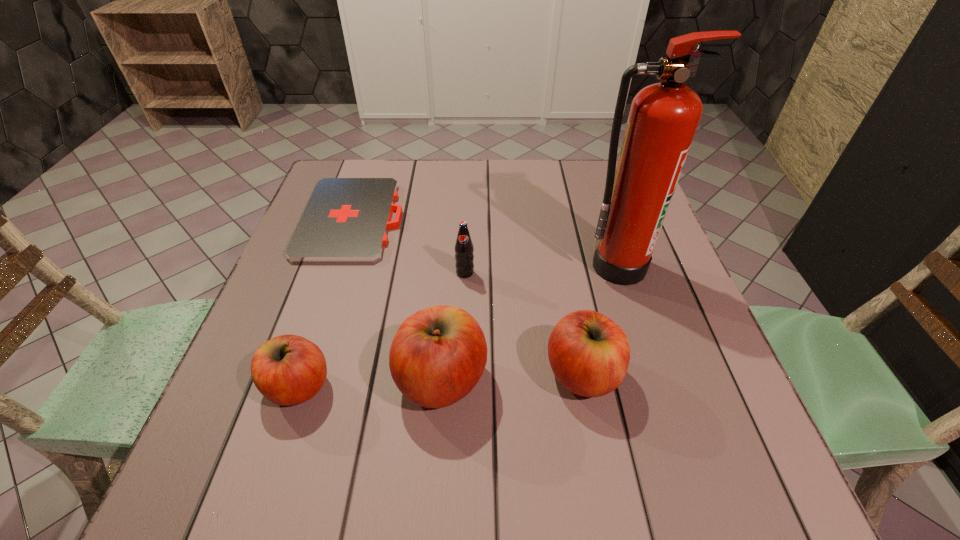
Image resolution: width=960 pixels, height=540 pixels. Find the location of `the leftmost apple`. the leftmost apple is located at coordinates (288, 370).

Find the location of a particular element. the shortest apple is located at coordinates (288, 370).

Find the location of a particular element. the second apple from left to right is located at coordinates (437, 356).

Locate an element on the screen. This screenshot has width=960, height=540. the rightmost apple is located at coordinates (589, 354).

Locate an element on the screen. The height and width of the screenshot is (540, 960). pop is located at coordinates (464, 257).

Where is `the first-aid kit`? the first-aid kit is located at coordinates (346, 220).

This screenshot has height=540, width=960. Find the location of `the tallest object`. the tallest object is located at coordinates (663, 119).

What are the coordinates of `vacant space located 0.220m on the back of the second shortest object` in the screenshot? It's located at (334, 279).

Locate an element on the screen. vacant area situated on the back of the second apple from right to left is located at coordinates (452, 227).

Find the location of a particular element. Image resolution: width=960 pixels, height=540 pixels. vacant space located 0.200m on the left of the rightmost apple is located at coordinates (438, 374).